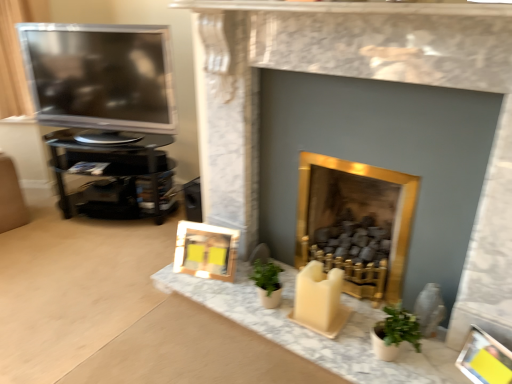
Question: Is satin black television at left taller or shorter than wooden frame at lower center, which ranks as the first picture frame in back-to-front order?

Choices:
 (A) tall
 (B) short

Answer: (A)

Question: Does point (106, 61) appear closer or farther from the camera than point (205, 235)?

Choices:
 (A) closer
 (B) farther

Answer: (B)

Question: Estimate the real-world distances between objects in this image. Which object is farther from the satin black television at left?

Choices:
 (A) gold metallic fireplace at center, which is the 2th fireplace from left to right
 (B) matte gray vase at lower right
 (C) wooden frame at lower center, which is counted as the 1th picture frame, starting from the top
 (D) yellow paper picture frame at lower right, the first picture frame when ordered from front to back
 (E) gold marble fireplace at center, acting as the first fireplace starting from the left

Answer: (D)

Question: Estimate the real-world distances between objects in this image. Which object is farther from the black glossy tv stand at left?

Choices:
 (A) gold metallic fireplace at center, which is the 2th fireplace from left to right
 (B) gold marble fireplace at center, which is the second fireplace from right to left
 (C) yellow paper picture frame at lower right, placed as the 2th picture frame when sorted from left to right
 (D) matte gray vase at lower right
 (E) wooden frame at lower center, which ranks as the first picture frame in back-to-front order

Answer: (C)